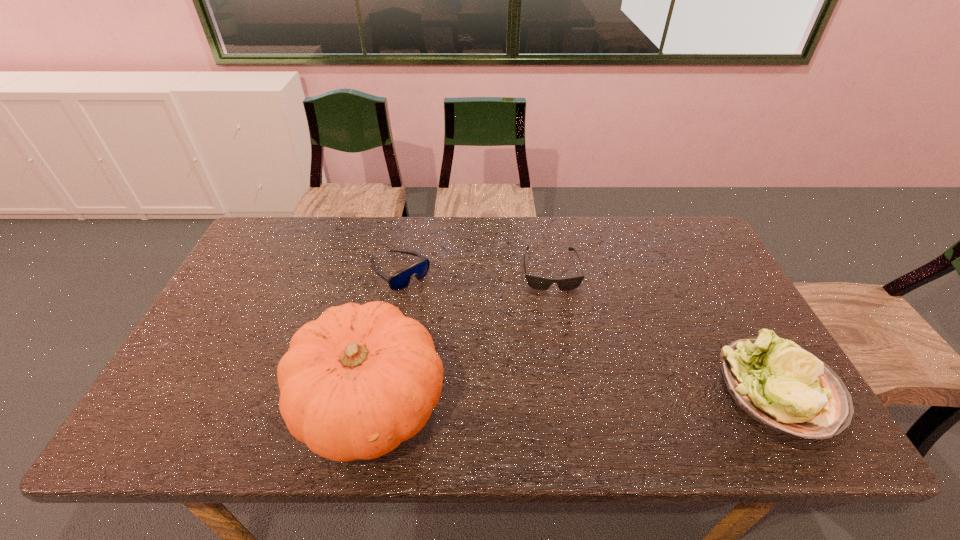
What are the coordinates of `the tallest object` in the screenshot? It's located at (355, 383).

Identify the location of lettuce. The width and height of the screenshot is (960, 540). (784, 387).

Image resolution: width=960 pixels, height=540 pixels. What are the coordinates of `the third shortest object` in the screenshot? It's located at (784, 387).

At what (x,y) coordinates should I click in order to perform the action: click on the third object from left to right. Please return your answer as a coordinate pair (x, y). Looking at the image, I should click on (540, 283).

Find the location of a particular element. This screenshot has height=540, width=960. the shortest object is located at coordinates (540, 283).

You are a GUI agent. You are given a task and a screenshot of the screen. Output one action in this format:
    pyautogui.click(x=<x>, y=<y>)
    Task: Click on the left sunglasses
    Image resolution: width=960 pixels, height=540 pixels.
    Given the screenshot: What is the action you would take?
    pyautogui.click(x=400, y=280)

At what (x,y) coordinates should I click in order to perform the action: click on the third tallest object. Please return your answer as a coordinate pair (x, y). Image resolution: width=960 pixels, height=540 pixels. Looking at the image, I should click on (400, 280).

This screenshot has width=960, height=540. In order to click on vacant space located on the right of the tallest object in this screenshot , I will do point(589,404).

In order to click on free space located 0.130m on the back of the lettuce in this screenshot , I will do `click(732, 307)`.

This screenshot has height=540, width=960. Find the location of `free space located 0.310m on the front-facing side of the right sunglasses`. free space located 0.310m on the front-facing side of the right sunglasses is located at coordinates [x=564, y=384].